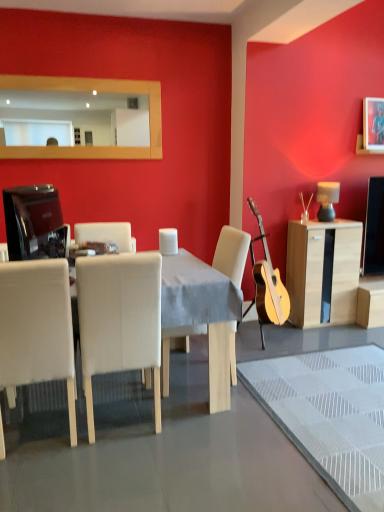
Identify the location of white leather chair at left, the third chair positioned from the right. 37,328.

Where is `matte black lamp at right`? The image size is (384, 512). matte black lamp at right is located at coordinates (327, 200).

Identify the location of matte black television at left. (34, 223).

What do you see at coordinates (34, 223) in the screenshot? This screenshot has width=384, height=512. I see `matte black television at left` at bounding box center [34, 223].

Image resolution: width=384 pixels, height=512 pixels. What do you see at coordinates (323, 271) in the screenshot? I see `light wood cabinet at right` at bounding box center [323, 271].

The height and width of the screenshot is (512, 384). Identify the location of white fabric chair at center, positioned as the second chair in right-to-left order. (119, 320).

Is white leather table at center oriented away from white leather chair at left, placed as the 1th chair when sorted from left to right?

Yes, white leather chair at left, placed as the 1th chair when sorted from left to right, is at the back of white leather table at center.

Does white leather table at center have a lesser width compared to white leather chair at left, placed as the 1th chair when sorted from left to right?

Incorrect, the width of white leather table at center is not less than that of white leather chair at left, placed as the 1th chair when sorted from left to right.

Considering the relative positions of white leather table at center and white leather chair at left, the third chair positioned from the right, in the image provided, is white leather table at center to the left or to the right of white leather chair at left, the third chair positioned from the right,?

Clearly, white leather table at center is on the right of white leather chair at left, the third chair positioned from the right, in the image.

Considering the relative sizes of white leather table at center and white leather chair at left, the third chair positioned from the right, in the image provided, is white leather table at center smaller than white leather chair at left, the third chair positioned from the right,?

No.

How much distance is there between white leather chair at left, the third chair positioned from the right, and white leather table at center?

A distance of 67.04 centimeters exists between white leather chair at left, the third chair positioned from the right, and white leather table at center.

From a real-world perspective, is white leather chair at left, placed as the 1th chair when sorted from left to right, on white leather table at center?

Correct, in the physical world, white leather chair at left, placed as the 1th chair when sorted from left to right, is higher than white leather table at center.

Is white leather chair at left, the third chair positioned from the right, to the left or to the right of white leather table at center in the image?

In the image, white leather chair at left, the third chair positioned from the right, appears on the left side of white leather table at center.

Is the position of white leather chair at left, placed as the 1th chair when sorted from left to right, less distant than that of white leather table at center?

Yes.

Can you confirm if metallic silver picture frame at upper right is thinner than white fabric chair at center, which ranks as the first chair in right-to-left order?

Correct, the width of metallic silver picture frame at upper right is less than that of white fabric chair at center, which ranks as the first chair in right-to-left order.

Is point (373, 112) farther from viewer compared to point (236, 236)?

Yes, point (373, 112) is behind point (236, 236).

In the image, is metallic silver picture frame at upper right positioned in front of or behind white fabric chair at center, which ranks as the first chair in right-to-left order?

metallic silver picture frame at upper right is behind white fabric chair at center, which ranks as the first chair in right-to-left order.

Could you tell me if metallic silver picture frame at upper right is turned towards white fabric chair at center, the 3th chair when ordered from left to right?

No.

Are white fabric chair at center, the 2th chair when ordered from left to right, and light wood cabinet at right beside each other?

No, white fabric chair at center, the 2th chair when ordered from left to right, is not next to light wood cabinet at right.

Could you measure the distance between white fabric chair at center, the 2th chair when ordered from left to right, and light wood cabinet at right?

1.88 meters.

Is white fabric chair at center, the 2th chair when ordered from left to right, located outside light wood cabinet at right?

white fabric chair at center, the 2th chair when ordered from left to right, is positioned outside light wood cabinet at right.

Identify the location of the 2nd chair in front of the light wood cabinet at right, starting your count from the anchor. (119, 320).

Do you think white leather chair at left, placed as the 1th chair when sorted from left to right, is within white fabric chair at center, the 2th chair when ordered from left to right, or outside of it?

white leather chair at left, placed as the 1th chair when sorted from left to right, exists outside the volume of white fabric chair at center, the 2th chair when ordered from left to right.

Are white leather chair at left, placed as the 1th chair when sorted from left to right, and white fabric chair at center, the 2th chair when ordered from left to right, beside each other?

white leather chair at left, placed as the 1th chair when sorted from left to right, and white fabric chair at center, the 2th chair when ordered from left to right, are not in contact.

Would you say white leather chair at left, placed as the 1th chair when sorted from left to right, is to the left or to the right of white fabric chair at center, positioned as the second chair in right-to-left order, in the picture?

From the image, it's evident that white leather chair at left, placed as the 1th chair when sorted from left to right, is to the left of white fabric chair at center, positioned as the second chair in right-to-left order.

Looking at this image, from the image's perspective, is matte black television at left above or below light wood cabinet at right?

From the image's perspective, matte black television at left appears above light wood cabinet at right.

Is matte black television at left inside the boundaries of light wood cabinet at right, or outside?

matte black television at left exists outside the volume of light wood cabinet at right.

Considering the sizes of objects matte black television at left and light wood cabinet at right in the image provided, who is bigger, matte black television at left or light wood cabinet at right?

Bigger between the two is light wood cabinet at right.

Considering the relative positions of matte black television at left and light wood cabinet at right in the image provided, is matte black television at left in front of light wood cabinet at right?

Yes, it is.

How many degrees apart are the facing directions of matte black lamp at right and metallic silver picture frame at upper right?

0.927 degrees separate the facing orientations of matte black lamp at right and metallic silver picture frame at upper right.

Is metallic silver picture frame at upper right surrounded by matte black lamp at right?

No, metallic silver picture frame at upper right is not a part of matte black lamp at right.

Which of these two, matte black lamp at right or metallic silver picture frame at upper right, is bigger?

With larger size is matte black lamp at right.

What are the coordinates of `picture frame located on the right of matte black lamp at right` in the screenshot? It's located at (x=373, y=124).

Locate an element on the screen. chair in front of the white leather table at center is located at coordinates (37, 328).

Identify the location of the 1st chair positioned above the white leather table at center (from the image's perspective). Image resolution: width=384 pixels, height=512 pixels. (37, 328).

Looking at the image, which one is located closer to light wood cabinet at right, white leather chair at left, the third chair positioned from the right, or matte black lamp at right?

matte black lamp at right.

Considering their positions, is white leather chair at left, the third chair positioned from the right, positioned further to matte black lamp at right than white leather table at center?

Based on the image, white leather chair at left, the third chair positioned from the right, appears to be further to matte black lamp at right.

From the image, which object appears to be farther from matte black television at left, white fabric chair at center, which ranks as the first chair in right-to-left order, or wooden frame mirror at upper center?

wooden frame mirror at upper center lies further to matte black television at left than the other object.

From the image, which object appears to be nearer to white fabric chair at center, positioned as the second chair in right-to-left order, matte black television at left or matte black lamp at right?

Among the two, matte black television at left is located nearer to white fabric chair at center, positioned as the second chair in right-to-left order.

Looking at the image, which one is located further to white leather table at center, matte black television at left or white leather chair at left, the third chair positioned from the right?

matte black television at left lies further to white leather table at center than the other object.

Looking at the image, which one is located further to matte black television at left, white leather chair at left, placed as the 1th chair when sorted from left to right, or light wood cabinet at right?

light wood cabinet at right is positioned further to the anchor matte black television at left.

Based on their spatial positions, is white leather table at center or matte black television at left further from white fabric chair at center, which ranks as the first chair in right-to-left order?

matte black television at left.

Which object lies nearer to the anchor point white leather table at center, light wood cabinet at right or matte black television at left?

matte black television at left lies closer to white leather table at center than the other object.

At what (x,y) coordinates should I click in order to perform the action: click on television located between wooden frame mirror at upper center and light wood cabinet at right in the left-right direction. Please return your answer as a coordinate pair (x, y). This screenshot has width=384, height=512. Looking at the image, I should click on (34, 223).

At what (x,y) coordinates should I click in order to perform the action: click on television between wooden frame mirror at upper center and metallic silver picture frame at upper right in the horizontal direction. Please return your answer as a coordinate pair (x, y). Looking at the image, I should click on point(34,223).

This screenshot has height=512, width=384. What are the coordinates of `television between white leather chair at left, the third chair positioned from the right, and light wood cabinet at right from left to right` in the screenshot? It's located at (34, 223).

Where is `cabinetry between white fabric chair at center, the 3th chair when ordered from left to right, and matte black lamp at right`? cabinetry between white fabric chair at center, the 3th chair when ordered from left to right, and matte black lamp at right is located at coordinates (323, 271).